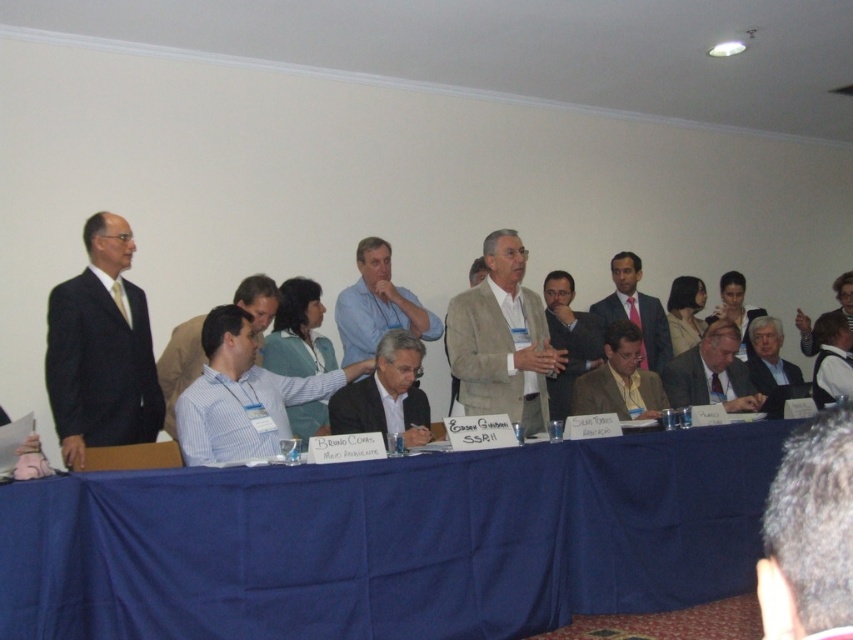
You are a photographer at the back of the room and want to take a photo of the light brown suit at center and the matte gray suit at center. Which one will be closer to the camera in the photo?

The light brown suit at center will be closer to the camera because it is in front of the matte gray suit at center.

You are standing at the back of the room and want to walk to the table. There are two points marked on the floor, point (523,257) and point (635,276). Which point should you step on first to reach the table efficiently?

Point (523,257) is in front of point (635,276), so you should step on point (523,257) first to reach the table efficiently.

In the formal meeting scene, there are two individuals dressed in a matte black suit at left and a matte white shirt at center. Which one is positioned to the left of the other?

The matte black suit at left is positioned to the left of the matte white shirt at center.